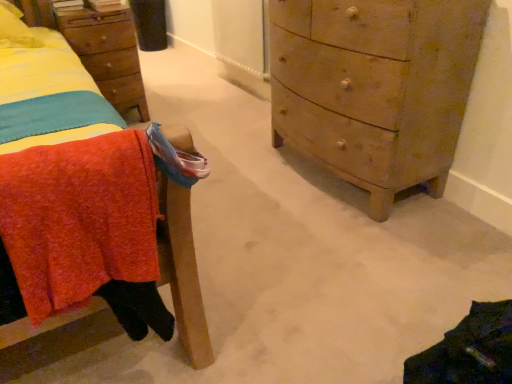
Question: Does wooden chest of drawers at right have a smaller size compared to wooden nightstand at upper left?

Choices:
 (A) no
 (B) yes

Answer: (A)

Question: Is wooden chest of drawers at right at the left side of wooden nightstand at upper left?

Choices:
 (A) no
 (B) yes

Answer: (A)

Question: Does wooden chest of drawers at right touch wooden nightstand at upper left?

Choices:
 (A) yes
 (B) no

Answer: (B)

Question: Is wooden chest of drawers at right bigger than wooden nightstand at upper left?

Choices:
 (A) yes
 (B) no

Answer: (A)

Question: Can you confirm if wooden chest of drawers at right is taller than wooden nightstand at upper left?

Choices:
 (A) no
 (B) yes

Answer: (B)

Question: Could you tell me if wooden chest of drawers at right is facing wooden nightstand at upper left?

Choices:
 (A) no
 (B) yes

Answer: (A)

Question: From the image's perspective, would you say wooden nightstand at upper left is shown under knitted wool blanket at left?

Choices:
 (A) yes
 (B) no

Answer: (B)

Question: Is wooden nightstand at upper left smaller than knitted wool blanket at left?

Choices:
 (A) no
 (B) yes

Answer: (A)

Question: Is wooden nightstand at upper left bigger than knitted wool blanket at left?

Choices:
 (A) yes
 (B) no

Answer: (A)

Question: Is wooden nightstand at upper left aimed at knitted wool blanket at left?

Choices:
 (A) no
 (B) yes

Answer: (B)

Question: Is wooden nightstand at upper left positioned far away from knitted wool blanket at left?

Choices:
 (A) yes
 (B) no

Answer: (B)

Question: From a real-world perspective, is wooden nightstand at upper left physically below knitted wool blanket at left?

Choices:
 (A) no
 (B) yes

Answer: (B)

Question: Is knitted wool blanket at left in contact with wooden chest of drawers at right?

Choices:
 (A) no
 (B) yes

Answer: (A)